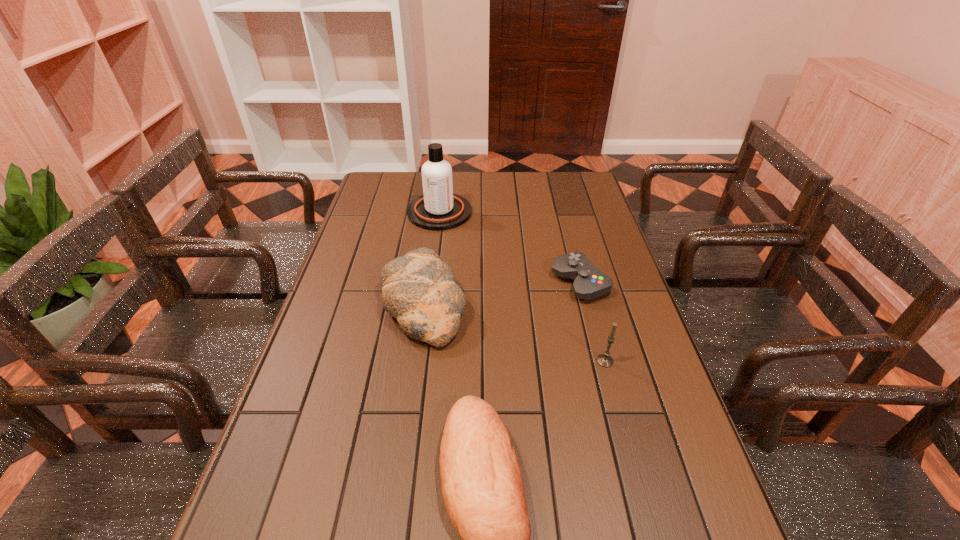
Where is `cleansing agent`? The height and width of the screenshot is (540, 960). cleansing agent is located at coordinates (438, 209).

The height and width of the screenshot is (540, 960). In order to click on the tallest object in this screenshot , I will do `click(438, 209)`.

The image size is (960, 540). In order to click on candle in this screenshot , I will do `click(605, 360)`.

Find the location of a particular element. This screenshot has width=960, height=540. the farther bread is located at coordinates (418, 289).

Locate an element on the screen. This screenshot has width=960, height=540. control is located at coordinates pyautogui.click(x=590, y=282).

The width and height of the screenshot is (960, 540). What are the coordinates of `vacant space located on the front of the tallest object` in the screenshot? It's located at pos(430,288).

Locate an element on the screen. Image resolution: width=960 pixels, height=540 pixels. vacant space located on the back of the candle is located at coordinates [x=588, y=299].

Locate an element on the screen. Image resolution: width=960 pixels, height=540 pixels. free spot located 0.110m on the back of the farther bread is located at coordinates (431, 244).

You are a GUI agent. You are given a task and a screenshot of the screen. Output one action in this format:
    pyautogui.click(x=<x>, y=<y>)
    Task: Click on the vacant area located 0.060m on the front of the shortest object
    The height and width of the screenshot is (540, 960).
    Given the screenshot: What is the action you would take?
    pyautogui.click(x=589, y=321)

Where is `object located in the far edge section of the desktop`? object located in the far edge section of the desktop is located at coordinates (438, 209).